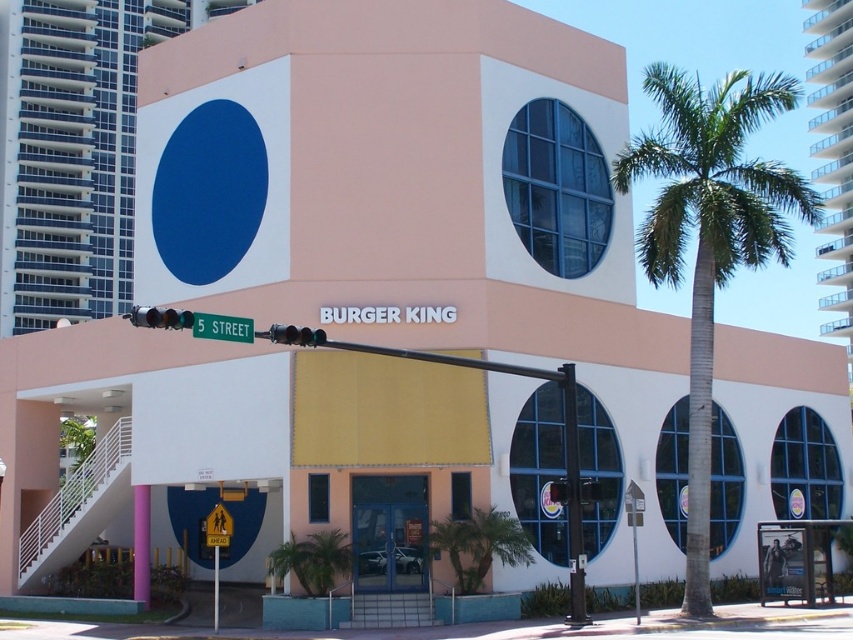
Between green leafy palm tree at right and metallic traffic light at left, which one has less height?

Standing shorter between the two is metallic traffic light at left.

Between green leafy palm tree at right and metallic traffic light at left, which one appears on the left side from the viewer's perspective?

metallic traffic light at left

Does point (675, 125) come behind point (149, 312)?

Yes, it is behind point (149, 312).

In order to click on green leafy palm tree at right in this screenshot , I will do (x=711, y=236).

Can you confirm if green leafy palm tree at right is smaller than metallic traffic light at center?

No.

Is green leafy palm tree at right to the left of metallic traffic light at center from the viewer's perspective?

Incorrect, green leafy palm tree at right is not on the left side of metallic traffic light at center.

Between point (651, 160) and point (550, 484), which one is positioned behind?

Positioned behind is point (651, 160).

Where is `green leafy palm tree at right`? This screenshot has height=640, width=853. green leafy palm tree at right is located at coordinates (711, 236).

Is metallic traffic light at left to the right of black glass traffic light at center from the viewer's perspective?

No, metallic traffic light at left is not to the right of black glass traffic light at center.

Which is above, metallic traffic light at left or black glass traffic light at center?

metallic traffic light at left is above.

Which is in front, point (155, 314) or point (305, 332)?

Positioned in front is point (155, 314).

Find the location of `metallic traffic light at left`. metallic traffic light at left is located at coordinates (160, 317).